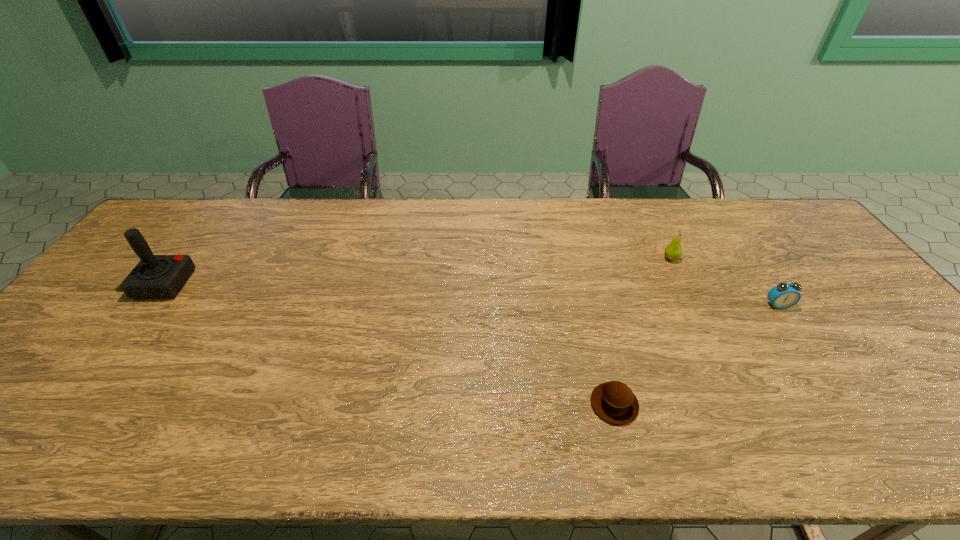
Identify the location of free space located 0.390m on the face of the second shortest object. (874, 447).

The height and width of the screenshot is (540, 960). I want to click on blank space located 0.130m on the back of the second object from left to right, so click(598, 340).

I want to click on object that is at the near edge, so click(614, 402).

What are the coordinates of `object present at the left edge` in the screenshot? It's located at [x=156, y=276].

Image resolution: width=960 pixels, height=540 pixels. What are the coordinates of `vacant space at the far edge` in the screenshot? It's located at (736, 232).

You are a GUI agent. You are given a task and a screenshot of the screen. Output one action in this format:
    pyautogui.click(x=<x>, y=<y>)
    Task: Click on the vacant region at the near edge of the desktop
    The height and width of the screenshot is (540, 960).
    Given the screenshot: What is the action you would take?
    coord(297,437)

Find the location of a particular element. Image resolution: width=960 pixels, height=540 pixels. vacant space at the left edge of the desktop is located at coordinates (53, 417).

Where is `vacant space at the right edge of the desktop`? This screenshot has width=960, height=540. vacant space at the right edge of the desktop is located at coordinates (887, 369).

In the image, there is a desktop. Where is `vacant area at the far left corner`? The height and width of the screenshot is (540, 960). vacant area at the far left corner is located at coordinates (161, 240).

This screenshot has width=960, height=540. In the image, there is a desktop. Find the location of `vacant space at the far right corner`. vacant space at the far right corner is located at coordinates (792, 228).